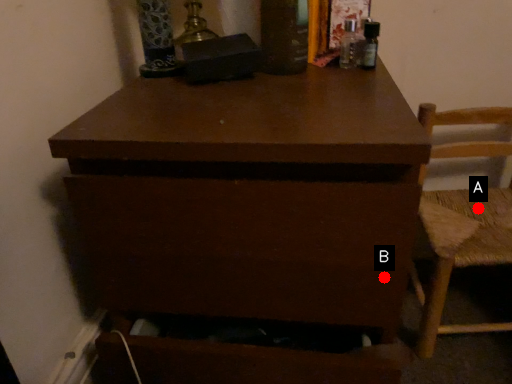
Question: Two points are circled on the image, labeled by A and B beside each circle. Among these points, which one is farthest from the camera?

Choices:
 (A) A is further
 (B) B is further

Answer: (A)